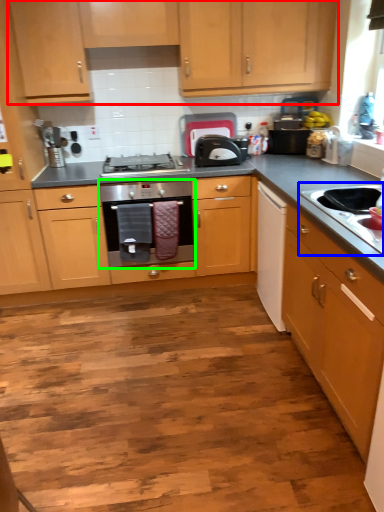
Question: Which object is the farthest from cabinetry (highlighted by a red box)? Choose among these: sink (highlighted by a blue box) or home appliance (highlighted by a green box).

Choices:
 (A) sink
 (B) home appliance

Answer: (A)